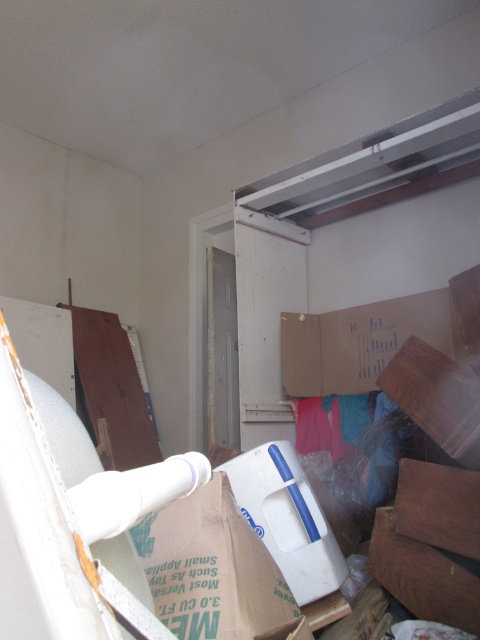
Looking at this image, is cardboard box at center to the left of cardboard at upper center from the viewer's perspective?

Correct, you'll find cardboard box at center to the left of cardboard at upper center.

This screenshot has width=480, height=640. What do you see at coordinates (215, 570) in the screenshot?
I see `cardboard box at center` at bounding box center [215, 570].

Does point (135, 541) come closer to viewer compared to point (424, 323)?

Yes, point (135, 541) is closer to viewer.

Locate an element on the screen. cardboard box at center is located at coordinates (215, 570).

Describe the element at coordinates (215, 570) in the screenshot. The image size is (480, 640). I see `cardboard box at center` at that location.

You are a GUI agent. You are given a task and a screenshot of the screen. Output one action in this format:
    pyautogui.click(x=<x>, y=<y>)
    Task: Click on the cardboard box at center
    Image resolution: width=480 pixels, height=640 pixels.
    Given the screenshot: What is the action you would take?
    pyautogui.click(x=215, y=570)

Identify the location of cardboard box at center. The width and height of the screenshot is (480, 640). (215, 570).

In the scene shown: Who is more forward, [428,333] or [326,579]?

Point [326,579] is more forward.

The width and height of the screenshot is (480, 640). What are the coordinates of `cardboard at upper center` in the screenshot? It's located at (359, 340).